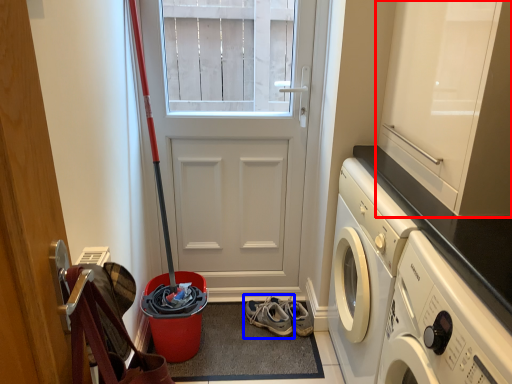
Question: Which point is further to the camera, cabinetry (highlighted by a red box) or footwear (highlighted by a blue box)?

Choices:
 (A) cabinetry
 (B) footwear

Answer: (B)